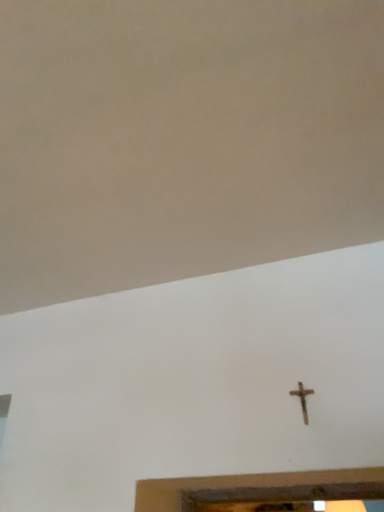
Question: Is rusty metal cross at center-right turned away from beige matte wall at upper center?

Choices:
 (A) yes
 (B) no

Answer: (B)

Question: Is rusty metal cross at center-right oriented towards beige matte wall at upper center?

Choices:
 (A) no
 (B) yes

Answer: (A)

Question: From the image's perspective, does rusty metal cross at center-right appear lower than beige matte wall at upper center?

Choices:
 (A) no
 (B) yes

Answer: (B)

Question: Does rusty metal cross at center-right appear on the left side of beige matte wall at upper center?

Choices:
 (A) no
 (B) yes

Answer: (A)

Question: Could beige matte wall at upper center be considered to be inside rusty metal cross at center-right?

Choices:
 (A) no
 (B) yes

Answer: (A)

Question: From the image's perspective, would you say rusty metal cross at center-right is positioned over beige matte wall at upper center?

Choices:
 (A) no
 (B) yes

Answer: (A)

Question: From the image's perspective, is beige matte wall at upper center beneath rusty metal cross at center-right?

Choices:
 (A) yes
 (B) no

Answer: (B)

Question: Is there a large distance between beige matte wall at upper center and rusty metal cross at center-right?

Choices:
 (A) no
 (B) yes

Answer: (A)

Question: Is beige matte wall at upper center outside rusty metal cross at center-right?

Choices:
 (A) no
 (B) yes

Answer: (B)

Question: Is rusty metal cross at center-right completely or partially inside beige matte wall at upper center?

Choices:
 (A) yes
 (B) no

Answer: (B)

Question: Considering the relative positions of beige matte wall at upper center and rusty metal cross at center-right in the image provided, is beige matte wall at upper center in front of rusty metal cross at center-right?

Choices:
 (A) yes
 (B) no

Answer: (A)

Question: Is beige matte wall at upper center bigger than rusty metal cross at center-right?

Choices:
 (A) yes
 (B) no

Answer: (A)

Question: Considering the positions of rusty metal cross at center-right and beige matte wall at upper center in the image, is rusty metal cross at center-right taller or shorter than beige matte wall at upper center?

Choices:
 (A) short
 (B) tall

Answer: (B)